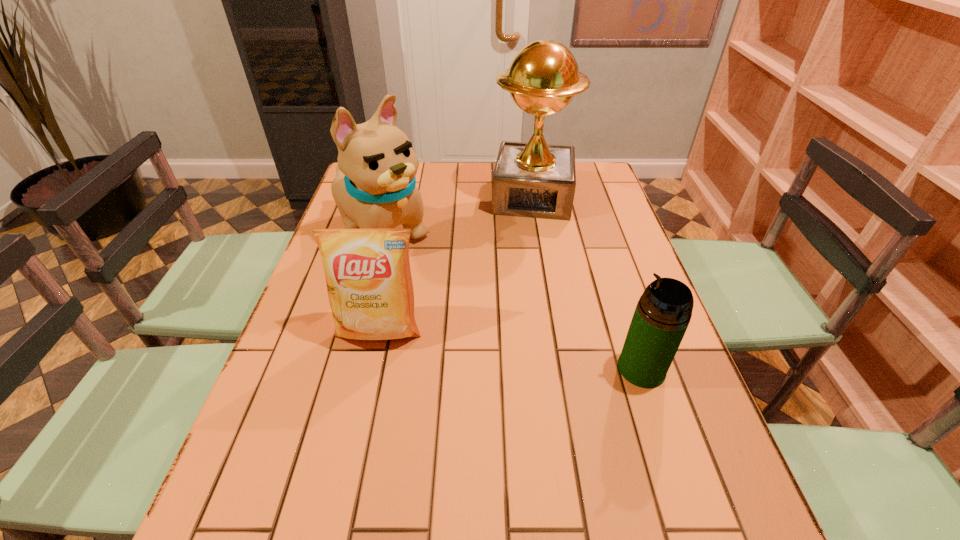
Identify the location of vacant space on the desktop that is between the crisp (potato chip) and the thermos bottle and is positioned on the face of the second tallest object. (539, 354).

At what (x,y) coordinates should I click in order to perform the action: click on free space on the desktop that is between the crisp (potato chip) and the thermos bottle and is positioned on the front-facing side of the award. Please return your answer as a coordinate pair (x, y). Looking at the image, I should click on (517, 350).